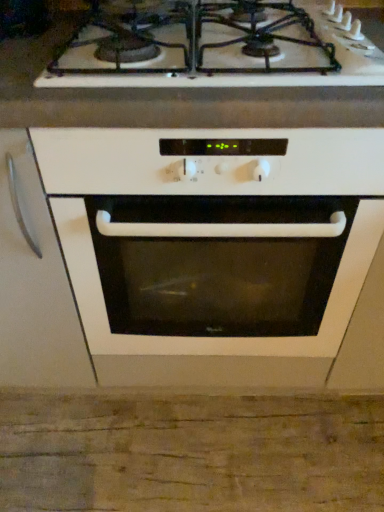
Question: Considering the relative sizes of white glossy oven at center and white glossy gas stove at upper center in the image provided, is white glossy oven at center taller than white glossy gas stove at upper center?

Choices:
 (A) yes
 (B) no

Answer: (A)

Question: From a real-world perspective, does white glossy oven at center stand above white glossy gas stove at upper center?

Choices:
 (A) yes
 (B) no

Answer: (B)

Question: Is white glossy gas stove at upper center located within white glossy oven at center?

Choices:
 (A) yes
 (B) no

Answer: (B)

Question: Considering the relative sizes of white glossy oven at center and white glossy gas stove at upper center in the image provided, is white glossy oven at center shorter than white glossy gas stove at upper center?

Choices:
 (A) no
 (B) yes

Answer: (A)

Question: Could you tell me if white glossy oven at center is facing white glossy gas stove at upper center?

Choices:
 (A) yes
 (B) no

Answer: (B)

Question: From the image's perspective, is white glossy oven at center located beneath white glossy gas stove at upper center?

Choices:
 (A) yes
 (B) no

Answer: (A)

Question: From the image's perspective, is white glossy gas stove at upper center below white glossy oven at center?

Choices:
 (A) yes
 (B) no

Answer: (B)

Question: Is white glossy gas stove at upper center closer to the viewer compared to white glossy oven at center?

Choices:
 (A) no
 (B) yes

Answer: (A)

Question: Are white glossy gas stove at upper center and white glossy oven at center located far from each other?

Choices:
 (A) no
 (B) yes

Answer: (A)

Question: Does white glossy gas stove at upper center have a smaller size compared to white glossy oven at center?

Choices:
 (A) yes
 (B) no

Answer: (A)

Question: Is white glossy gas stove at upper center at the right side of white glossy oven at center?

Choices:
 (A) no
 (B) yes

Answer: (A)

Question: Is white glossy gas stove at upper center looking in the opposite direction of white glossy oven at center?

Choices:
 (A) no
 (B) yes

Answer: (A)

Question: Is white glossy oven at center wider or thinner than white glossy gas stove at upper center?

Choices:
 (A) thin
 (B) wide

Answer: (B)